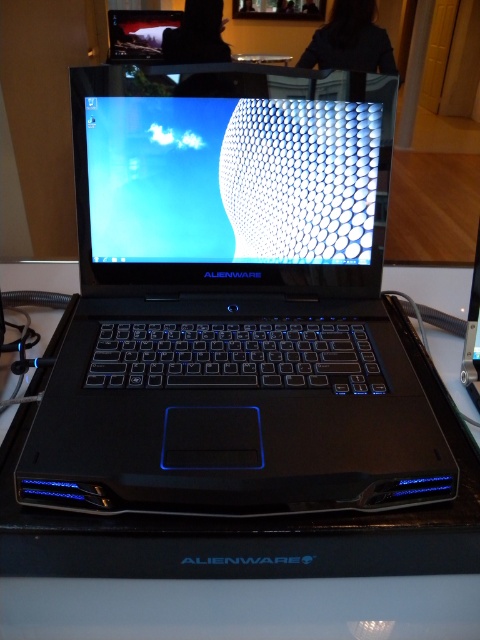
Question: Among these objects, which one is nearest to the camera?

Choices:
 (A) black plastic table at center
 (B) matte black screen at center

Answer: (A)

Question: Is matte black screen at center to the left of black plastic table at center from the viewer's perspective?

Choices:
 (A) no
 (B) yes

Answer: (A)

Question: Can you confirm if matte black laptop at center is positioned to the right of black plastic table at center?

Choices:
 (A) yes
 (B) no

Answer: (A)

Question: Which object is positioned closest to the black plastic table at center?

Choices:
 (A) matte black screen at center
 (B) matte black laptop at center

Answer: (B)

Question: Estimate the real-world distances between objects in this image. Which object is farther from the matte black screen at center?

Choices:
 (A) black plastic table at center
 (B) matte black laptop at center

Answer: (A)

Question: Does matte black laptop at center have a lesser width compared to matte black screen at center?

Choices:
 (A) no
 (B) yes

Answer: (A)